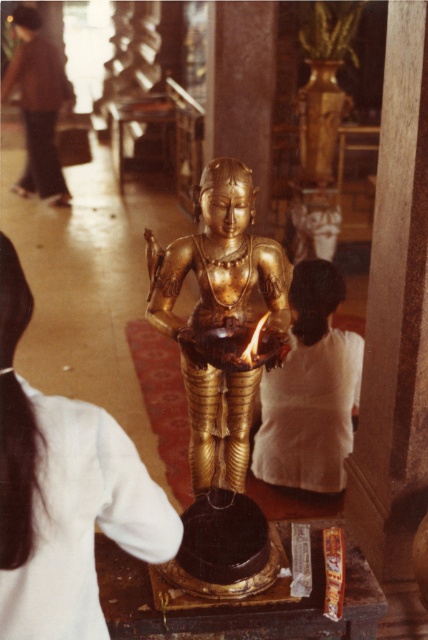
Question: Observing the image, what is the correct spatial positioning of gold polished statue at center in reference to white cotton robe at center?

Choices:
 (A) right
 (B) left

Answer: (B)

Question: Does white cotton robe at center have a lesser width compared to dark brown fabric pants at upper left?

Choices:
 (A) yes
 (B) no

Answer: (A)

Question: Estimate the real-world distances between objects in this image. Which object is farther from the gold polished statue at center?

Choices:
 (A) white cotton robe at center
 (B) dark brown fabric pants at upper left

Answer: (B)

Question: Among these objects, which one is farthest from the camera?

Choices:
 (A) gold polished statue at center
 (B) white cotton robe at center

Answer: (B)

Question: Among these objects, which one is farthest from the camera?

Choices:
 (A) dark brown fabric pants at upper left
 (B) gold polished statue at center

Answer: (A)

Question: Is gold polished statue at center smaller than dark brown fabric pants at upper left?

Choices:
 (A) yes
 (B) no

Answer: (A)